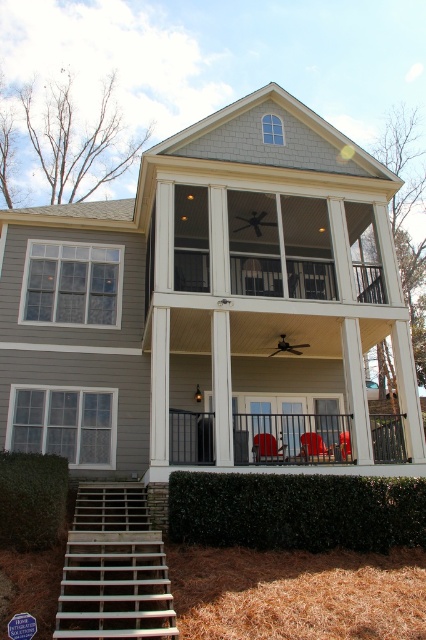
You are standing in the front yard of the house and see the metallic black railing at center and the green leafy hedge at lower left. Which object is located to the right of the other?

The metallic black railing at center is positioned on the right side of green leafy hedge at lower left.

You are planning to place a new bench that is the same width as the wooden stairs at lower left in the living room. The living room currently has the matte red chair at center. Will the bench fit through the double doors with glass panes flanked by black railings?

The wooden stairs at lower left are wider than the matte red chair at center. Since the bench is as wide as the wooden stairs, it might not fit through the doors if the doors are narrower than the stairs. However, the description does not provide door width details, so we cannot confirm. Please check the door dimensions.

You are standing at the entrance of the house and want to go to the wooden stairs at lower left. Which direction should you walk to reach them?

The wooden stairs at lower left are located at point (114, 570), so you should walk towards the lower left direction to reach them.